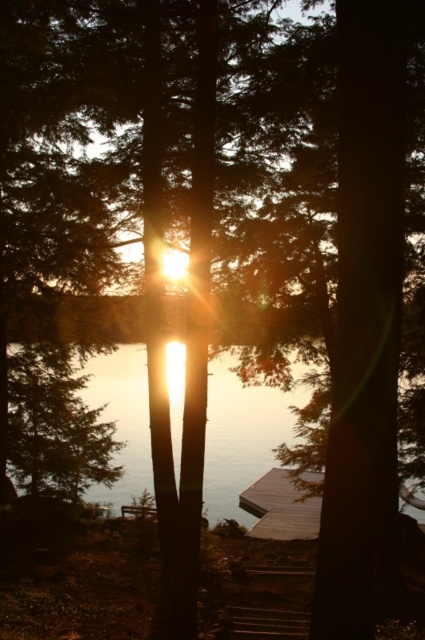
You are standing on the wooden dock and want to place a small floating lantern in the water. The lantern requires a specific placement at coordinates point A. According to the scene description, where should you place the lantern to ensure it is in the translucent glass water at center?

You should place the lantern at coordinates point A located at point [241,436] because the translucent glass water at center is situated there.

You are standing at the wooden dock and want to walk towards the point labeled point (271, 500). However, you notice another point labeled point (229, 403) closer to you. Which point should you aim for first to reach the farther point?

You should aim for point (229, 403) first because it is closer to you than point (271, 500), allowing you to progress toward the farther point step by step.